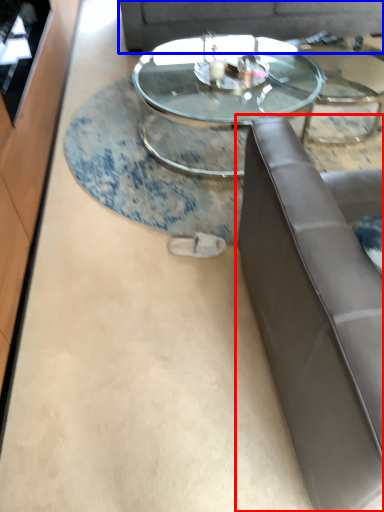
Question: Which point is closer to the camera, studio couch (highlighted by a red box) or couch (highlighted by a blue box)?

Choices:
 (A) studio couch
 (B) couch

Answer: (A)